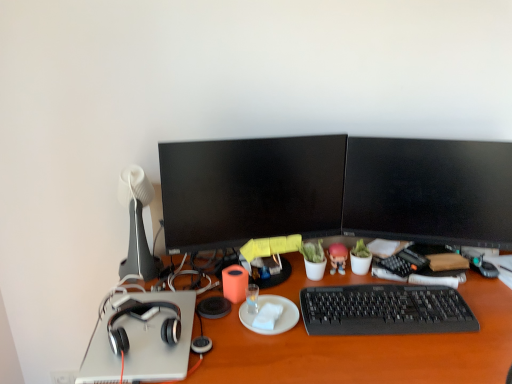
Locate an element on the screen. free location to the left of orange matte cup at center is located at coordinates (209, 299).